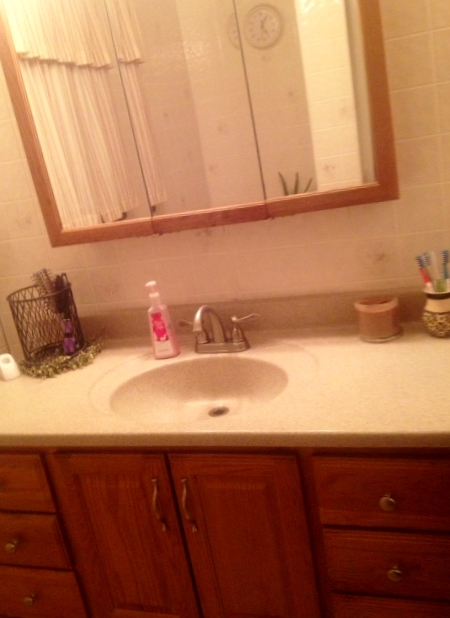
The height and width of the screenshot is (618, 450). Identify the location of white bathroom sink surface. (59, 403), (357, 399).